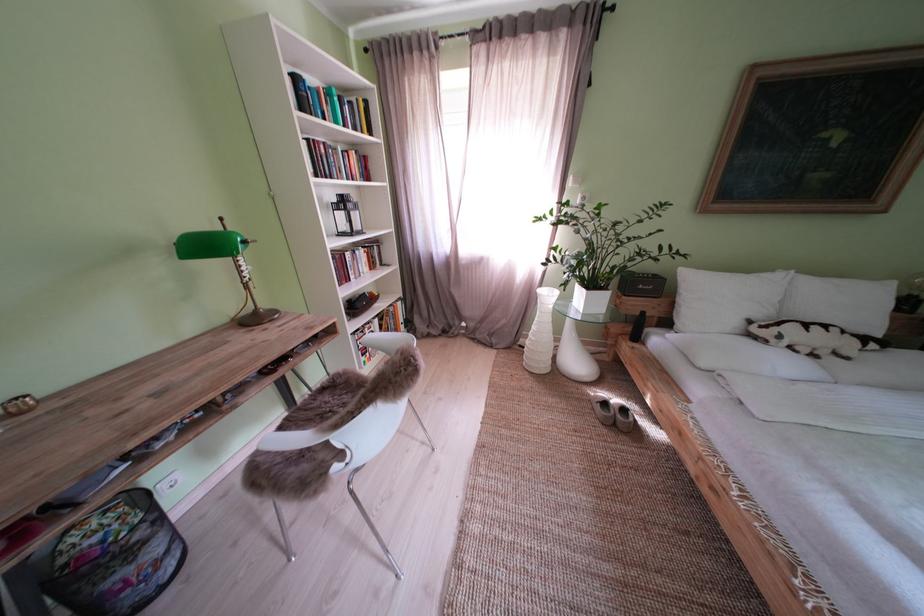
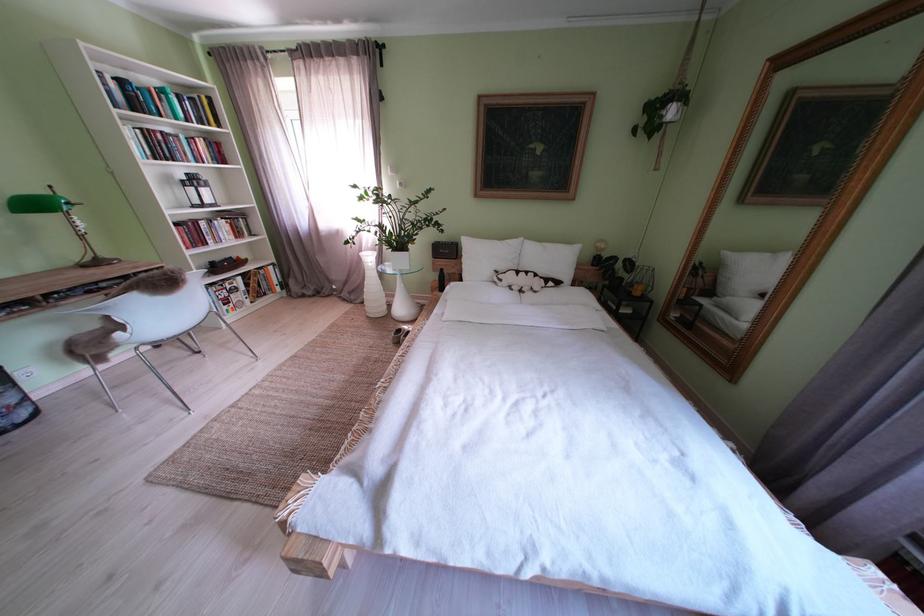
Where in the second image is the point corresponding to pixel 600 294 from the first image?

(405, 256)